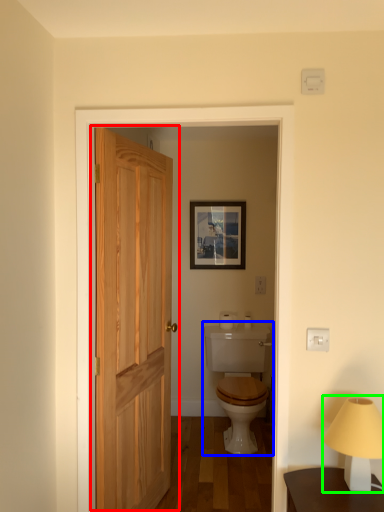
Question: Which object is positioned closest to door (highlighted by a red box)? Select from sink (highlighted by a blue box) and table lamp (highlighted by a green box).

Choices:
 (A) sink
 (B) table lamp

Answer: (A)